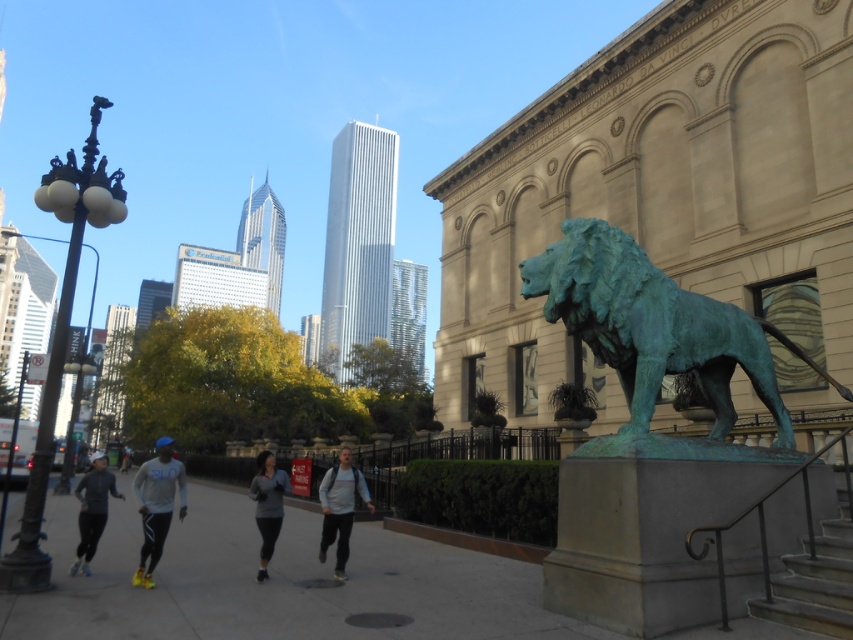
You are a delivery person who needs to place a small package on a surface in the scene. Which object between the gray concrete pavement at lower center and the gray fleece jacket at center would be more suitable for placing the package?

The gray concrete pavement at lower center is more suitable because it has a larger size compared to the gray fleece jacket at center, providing a stable and secure surface for the package.

You are a photographer standing at the base of the bronze lion statue. You want to capture a photo of the two people wearing the matte blue hoodie at center and the gray fabric jacket at center. Which one is positioned lower in the frame?

The matte blue hoodie at center is positioned below the gray fabric jacket at center, so it is lower in the frame.

Consider the image. You are a photographer standing at the base of the bronze lion statue. You notice two people wearing the matte blue hoodie at center and the gray fabric jacket at center. Which clothing item would you focus on to capture a more prominent subject in your photo?

The matte blue hoodie at center is larger in size than the gray fabric jacket at center, so focusing on the matte blue hoodie at center would result in a more prominent subject in your photo.